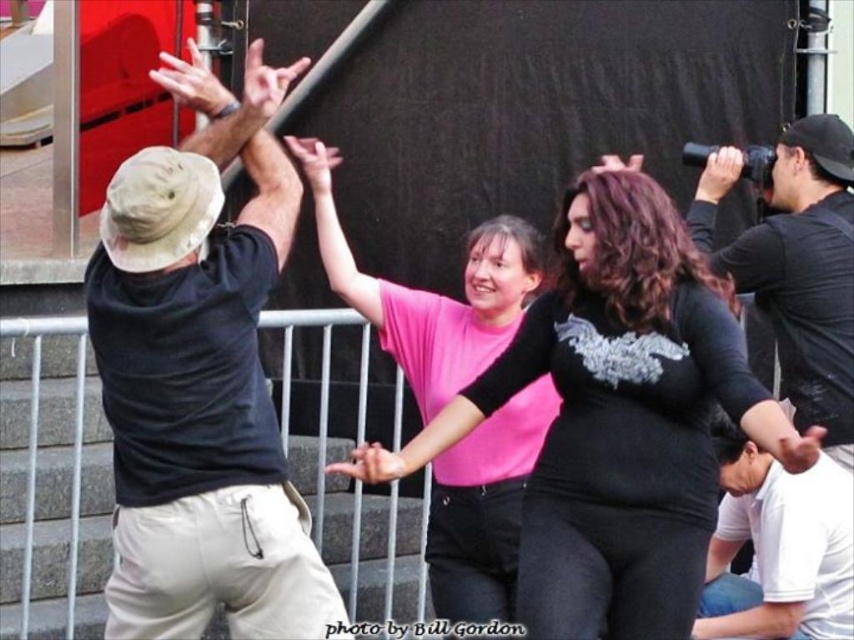
What is the color of the shorts worn by the person at the point marked as (200,378)?

The khaki cotton shorts at left are located at point (200,378), so the color is khaki.

Where is the matte black shirt at center located in the image?

The matte black shirt at center is located at point 0.653 on the x axis and 0.722 on the y axis.